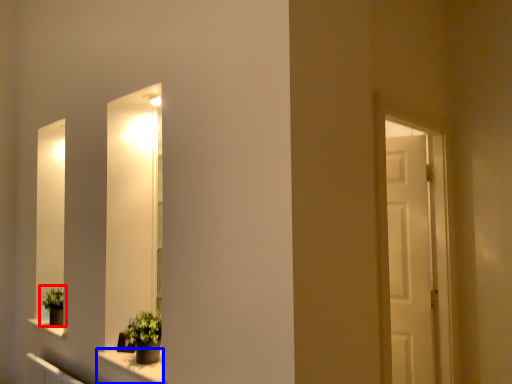
Question: Among these objects, which one is nearest to the camera, houseplant (highlighted by a red box) or window sill (highlighted by a blue box)?

Choices:
 (A) houseplant
 (B) window sill

Answer: (B)